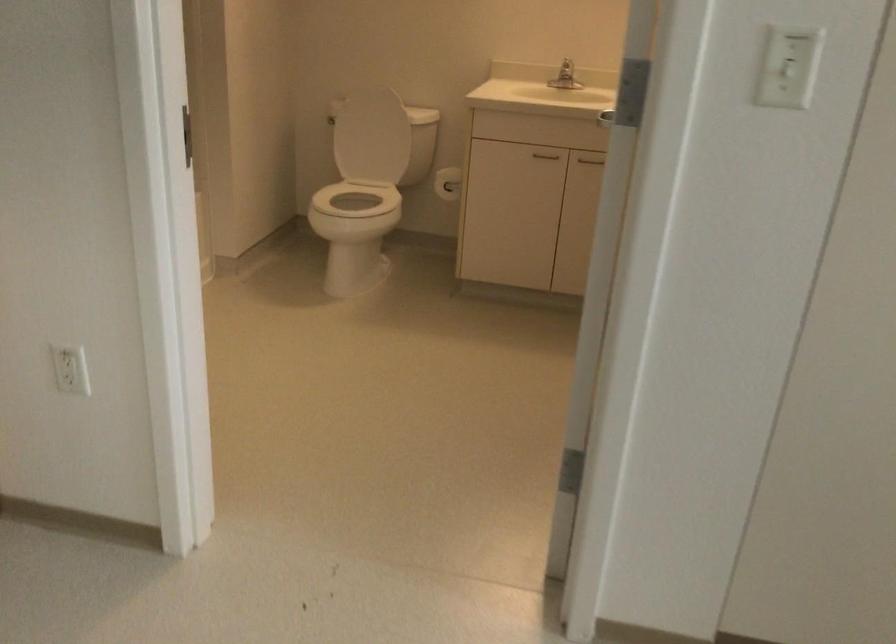
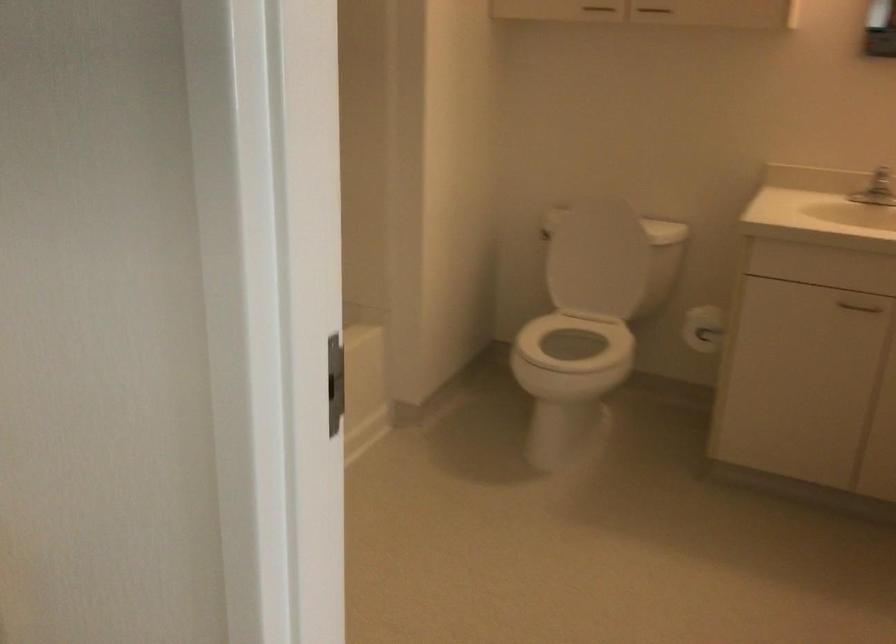
Locate, in the second image, the point that corresponds to [375,134] in the first image.

(596, 258)